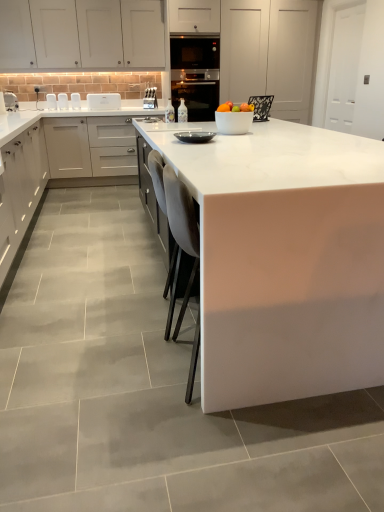
Question: Which direction should I rotate to look at matte black bowl at center, which ranks as the fourth appliance in top-to-bottom order, — up or down?

Choices:
 (A) up
 (B) down

Answer: (A)

Question: Is matte white cabinets at left, which ranks as the 2th cabinetry in top-to-bottom order, outside matte black bowl at center, which ranks as the fourth appliance in top-to-bottom order?

Choices:
 (A) yes
 (B) no

Answer: (A)

Question: From a real-world perspective, is matte white cabinets at left, acting as the second cabinetry starting from the bottom, physically above matte black bowl at center, placed as the second appliance when sorted from right to left?

Choices:
 (A) yes
 (B) no

Answer: (B)

Question: Is matte white cabinets at left, which ranks as the 2th cabinetry in top-to-bottom order, directly adjacent to matte black bowl at center, positioned as the fourth appliance in back-to-front order?

Choices:
 (A) yes
 (B) no

Answer: (B)

Question: Does matte white cabinets at left, which ranks as the 2th cabinetry in top-to-bottom order, contain matte black bowl at center, positioned as the fourth appliance in back-to-front order?

Choices:
 (A) yes
 (B) no

Answer: (B)

Question: Does matte white cabinets at left, acting as the second cabinetry starting from the bottom, have a greater width compared to matte black bowl at center, placed as the second appliance when sorted from right to left?

Choices:
 (A) yes
 (B) no

Answer: (A)

Question: Does matte white cabinets at left, acting as the second cabinetry starting from the bottom, have a smaller size compared to matte black bowl at center, placed as the 1th appliance when sorted from bottom to top?

Choices:
 (A) yes
 (B) no

Answer: (B)

Question: Is white matte cabinet at left, the 1th cabinetry ordered from the bottom, taller than white glossy countertop at center, which ranks as the first countertop in left-to-right order?

Choices:
 (A) no
 (B) yes

Answer: (A)

Question: From the image's perspective, is white matte cabinet at left, the 3th cabinetry when ordered from top to bottom, under white glossy countertop at center, the 2th countertop positioned from the right?

Choices:
 (A) yes
 (B) no

Answer: (A)

Question: Is white matte cabinet at left, the 1th cabinetry ordered from the bottom, not within white glossy countertop at center, the 2th countertop positioned from the right?

Choices:
 (A) yes
 (B) no

Answer: (B)

Question: Is white matte cabinet at left, the 3th cabinetry when ordered from top to bottom, behind white glossy countertop at center, the 2th countertop positioned from the right?

Choices:
 (A) no
 (B) yes

Answer: (B)

Question: Can you confirm if white matte cabinet at left, the 3th cabinetry when ordered from top to bottom, is bigger than white glossy countertop at center, which ranks as the first countertop in left-to-right order?

Choices:
 (A) no
 (B) yes

Answer: (A)

Question: Is white matte cabinet at left, the 3th cabinetry when ordered from top to bottom, positioned with its back to white glossy countertop at center, the 2th countertop positioned from the right?

Choices:
 (A) yes
 (B) no

Answer: (A)

Question: Does white glossy countertop at center, which ranks as the first countertop in left-to-right order, have a smaller size compared to white matte cabinet at left, the 1th cabinetry ordered from the bottom?

Choices:
 (A) no
 (B) yes

Answer: (A)